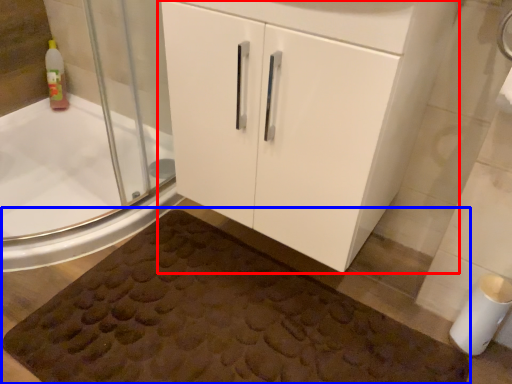
Question: Which point is closer to the camera, bathroom cabinet (highlighted by a red box) or bath mat (highlighted by a blue box)?

Choices:
 (A) bathroom cabinet
 (B) bath mat

Answer: (A)